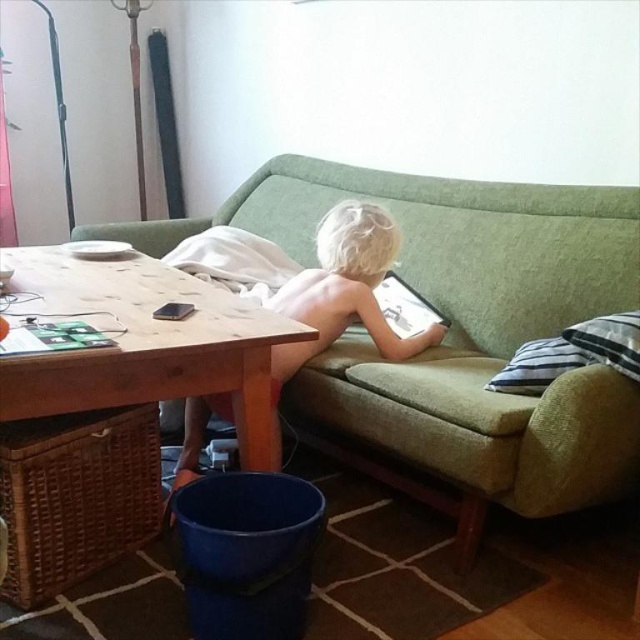
Between point (493, 404) and point (349, 232), which one is positioned in front?

Point (493, 404) is more forward.

Is point (310, 392) in front of point (356, 292)?

Yes, point (310, 392) is closer to viewer.

Find the location of a particular element. green fabric couch at center is located at coordinates click(461, 337).

Is woodenmaterial/texturetable at left shorter than blonde hair child at center?

Yes.

Between woodenmaterial/texturetable at left and blonde hair child at center, which one has more height?

Standing taller between the two is blonde hair child at center.

What do you see at coordinates (116, 403) in the screenshot? This screenshot has width=640, height=640. I see `woodenmaterial/texturetable at left` at bounding box center [116, 403].

Find the location of `woodenmaterial/texturetable at left`. woodenmaterial/texturetable at left is located at coordinates (116, 403).

Can you confirm if green fabric couch at center is taller than matte black tablet at center?

Correct, green fabric couch at center is much taller as matte black tablet at center.

Who is higher up, green fabric couch at center or matte black tablet at center?

Positioned higher is green fabric couch at center.

Which is in front, point (550, 477) or point (388, 296)?

Positioned in front is point (550, 477).

Find the location of `green fabric couch at center`. green fabric couch at center is located at coordinates (461, 337).